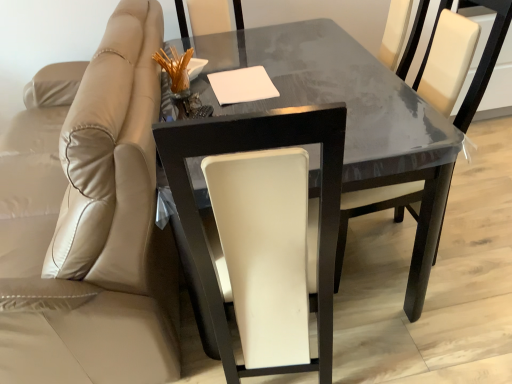
What do you see at coordinates (449, 61) in the screenshot? I see `white leather chair at center, positioned as the first chair in right-to-left order` at bounding box center [449, 61].

The image size is (512, 384). Identify the location of white leather chair at center, the third chair when ordered from left to right. (449, 61).

Find the location of a particular element. This screenshot has height=384, width=512. glossy dark wood table at center is located at coordinates (348, 114).

Image resolution: width=512 pixels, height=384 pixels. What do you see at coordinates (90, 225) in the screenshot? I see `beige leather chair at left, which appears as the third chair when viewed from the right` at bounding box center [90, 225].

Find the location of a particular element. The height and width of the screenshot is (384, 512). white leather chair at center, positioned as the first chair in right-to-left order is located at coordinates (449, 61).

Is beige leather chair at left, which is counted as the 1th chair, starting from the left, looking in the opposite direction of white leather chair at center, the third chair when ordered from left to right?

Absolutely, beige leather chair at left, which is counted as the 1th chair, starting from the left, is directed away from white leather chair at center, the third chair when ordered from left to right.

From a real-world perspective, is beige leather chair at left, which appears as the third chair when viewed from the right, above or below white leather chair at center, the third chair when ordered from left to right?

Clearly, from a real-world perspective, beige leather chair at left, which appears as the third chair when viewed from the right, is below white leather chair at center, the third chair when ordered from left to right.

Choose the correct answer: Is beige leather chair at left, which appears as the third chair when viewed from the right, inside white leather chair at center, positioned as the first chair in right-to-left order, or outside it?

beige leather chair at left, which appears as the third chair when viewed from the right, is outside white leather chair at center, positioned as the first chair in right-to-left order.

Considering the positions of point (61, 252) and point (419, 201), is point (61, 252) closer or farther from the camera than point (419, 201)?

Point (61, 252) is closer to the camera than point (419, 201).

Is white leather chair at center, which ranks as the second chair in right-to-left order, not near beige leather chair at left, which appears as the third chair when viewed from the right?

Indeed, white leather chair at center, which ranks as the second chair in right-to-left order, is not near beige leather chair at left, which appears as the third chair when viewed from the right.

From the image's perspective, between white leather chair at center, which ranks as the second chair in right-to-left order, and beige leather chair at left, which is counted as the 1th chair, starting from the left, who is located below?

beige leather chair at left, which is counted as the 1th chair, starting from the left, appears lower in the image.

Considering the sizes of white leather chair at center, placed as the 2th chair when sorted from left to right, and beige leather chair at left, which appears as the third chair when viewed from the right, in the image, is white leather chair at center, placed as the 2th chair when sorted from left to right, wider or thinner than beige leather chair at left, which appears as the third chair when viewed from the right,?

Considering their sizes, white leather chair at center, placed as the 2th chair when sorted from left to right, looks slimmer than beige leather chair at left, which appears as the third chair when viewed from the right.

Between glossy dark wood table at center and beige leather chair at left, which is counted as the 1th chair, starting from the left, which one appears on the left side from the viewer's perspective?

beige leather chair at left, which is counted as the 1th chair, starting from the left, is more to the left.

Between point (191, 290) and point (37, 320), which one is positioned in front?

The point (37, 320) is closer.

Would you say glossy dark wood table at center is inside or outside beige leather chair at left, which appears as the third chair when viewed from the right?

glossy dark wood table at center is not inside beige leather chair at left, which appears as the third chair when viewed from the right, it's outside.

Is white leather chair at center, the third chair when ordered from left to right, positioned with its back to glossy dark wood table at center?

Correct, white leather chair at center, the third chair when ordered from left to right, is looking away from glossy dark wood table at center.

Is point (435, 39) in front of point (389, 181)?

No.

Could you measure the distance between white leather chair at center, positioned as the first chair in right-to-left order, and glossy dark wood table at center?

45.23 centimeters.

Does white leather chair at center, positioned as the first chair in right-to-left order, have a greater height compared to glossy dark wood table at center?

Correct, white leather chair at center, positioned as the first chair in right-to-left order, is much taller as glossy dark wood table at center.

Can you confirm if beige leather chair at left, which appears as the third chair when viewed from the right, is positioned to the left of glossy dark wood table at center?

Yes.

Is beige leather chair at left, which appears as the third chair when viewed from the right, positioned far away from glossy dark wood table at center?

beige leather chair at left, which appears as the third chair when viewed from the right, is actually quite close to glossy dark wood table at center.

Locate an element on the screen. The height and width of the screenshot is (384, 512). table below the beige leather chair at left, which is counted as the 1th chair, starting from the left (from a real-world perspective) is located at coordinates (348, 114).

Based on the photo, which of these two, beige leather chair at left, which is counted as the 1th chair, starting from the left, or glossy dark wood table at center, is wider?

With larger width is beige leather chair at left, which is counted as the 1th chair, starting from the left.

Can you confirm if beige leather chair at left, which appears as the third chair when viewed from the right, is smaller than white leather chair at center, placed as the 2th chair when sorted from left to right?

No.

Considering the relative sizes of beige leather chair at left, which is counted as the 1th chair, starting from the left, and white leather chair at center, placed as the 2th chair when sorted from left to right, in the image provided, is beige leather chair at left, which is counted as the 1th chair, starting from the left, shorter than white leather chair at center, placed as the 2th chair when sorted from left to right,?

In fact, beige leather chair at left, which is counted as the 1th chair, starting from the left, may be taller than white leather chair at center, placed as the 2th chair when sorted from left to right.

Is beige leather chair at left, which is counted as the 1th chair, starting from the left, to the left or to the right of white leather chair at center, which ranks as the second chair in right-to-left order, in the image?

Clearly, beige leather chair at left, which is counted as the 1th chair, starting from the left, is on the left of white leather chair at center, which ranks as the second chair in right-to-left order, in the image.

Is beige leather chair at left, which is counted as the 1th chair, starting from the left, in front of or behind white leather chair at center, which ranks as the second chair in right-to-left order, in the image?

Visually, beige leather chair at left, which is counted as the 1th chair, starting from the left, is located in front of white leather chair at center, which ranks as the second chair in right-to-left order.

From the image's perspective, is glossy dark wood table at center under white leather chair at center, positioned as the first chair in right-to-left order?

Yes, from the image's perspective, glossy dark wood table at center is beneath white leather chair at center, positioned as the first chair in right-to-left order.

From a real-world perspective, is glossy dark wood table at center over white leather chair at center, the third chair when ordered from left to right?

No, from a real-world perspective, glossy dark wood table at center is not above white leather chair at center, the third chair when ordered from left to right.

Is glossy dark wood table at center at the right side of white leather chair at center, the third chair when ordered from left to right?

In fact, glossy dark wood table at center is to the left of white leather chair at center, the third chair when ordered from left to right.

Would you say glossy dark wood table at center is outside white leather chair at center, positioned as the first chair in right-to-left order?

Indeed, glossy dark wood table at center is completely outside white leather chair at center, positioned as the first chair in right-to-left order.

This screenshot has width=512, height=384. There is a white leather chair at center, the third chair when ordered from left to right. What are the coordinates of `the 1st chair above it (from the image's perspective)` in the screenshot? It's located at (90, 225).

From a real-world perspective, starting from the beige leather chair at left, which is counted as the 1th chair, starting from the left, which chair is the 2nd one vertically above it? Please provide its 2D coordinates.

[(207, 18)]

Looking at the image, which one is located closer to white leather chair at center, the third chair when ordered from left to right, beige leather chair at left, which appears as the third chair when viewed from the right, or white leather chair at center, which ranks as the second chair in right-to-left order?

white leather chair at center, which ranks as the second chair in right-to-left order.

From the picture: From the image, which object appears to be nearer to white leather chair at center, which ranks as the second chair in right-to-left order, white leather chair at center, positioned as the first chair in right-to-left order, or glossy dark wood table at center?

Among the two, glossy dark wood table at center is located nearer to white leather chair at center, which ranks as the second chair in right-to-left order.

Considering their positions, is beige leather chair at left, which appears as the third chair when viewed from the right, positioned closer to glossy dark wood table at center than white leather chair at center, which ranks as the second chair in right-to-left order?

Based on the image, beige leather chair at left, which appears as the third chair when viewed from the right, appears to be nearer to glossy dark wood table at center.

When comparing their distances from white leather chair at center, which ranks as the second chair in right-to-left order, does white leather chair at center, positioned as the first chair in right-to-left order, or beige leather chair at left, which is counted as the 1th chair, starting from the left, seem closer?

beige leather chair at left, which is counted as the 1th chair, starting from the left, is closer to white leather chair at center, which ranks as the second chair in right-to-left order.

Looking at the image, which one is located closer to glossy dark wood table at center, white leather chair at center, positioned as the first chair in right-to-left order, or beige leather chair at left, which appears as the third chair when viewed from the right?

white leather chair at center, positioned as the first chair in right-to-left order, is positioned closer to the anchor glossy dark wood table at center.

Looking at the image, which one is located further to beige leather chair at left, which is counted as the 1th chair, starting from the left, white leather chair at center, which ranks as the second chair in right-to-left order, or glossy dark wood table at center?

white leather chair at center, which ranks as the second chair in right-to-left order, is further to beige leather chair at left, which is counted as the 1th chair, starting from the left.

From the image, which object appears to be farther from white leather chair at center, positioned as the first chair in right-to-left order, beige leather chair at left, which is counted as the 1th chair, starting from the left, or glossy dark wood table at center?

beige leather chair at left, which is counted as the 1th chair, starting from the left.

Which object lies further to the anchor point glossy dark wood table at center, white leather chair at center, the third chair when ordered from left to right, or white leather chair at center, placed as the 2th chair when sorted from left to right?

The object further to glossy dark wood table at center is white leather chair at center, placed as the 2th chair when sorted from left to right.

The height and width of the screenshot is (384, 512). What are the coordinates of `chair between beige leather chair at left, which appears as the third chair when viewed from the right, and white leather chair at center, the third chair when ordered from left to right, in the horizontal direction` in the screenshot? It's located at (207, 18).

This screenshot has height=384, width=512. I want to click on table located between beige leather chair at left, which is counted as the 1th chair, starting from the left, and white leather chair at center, positioned as the first chair in right-to-left order, in the left-right direction, so click(348, 114).

Locate an element on the screen. This screenshot has height=384, width=512. table positioned between white leather chair at center, the third chair when ordered from left to right, and white leather chair at center, placed as the 2th chair when sorted from left to right, from near to far is located at coordinates coord(348,114).

Where is `table located between beige leather chair at left, which is counted as the 1th chair, starting from the left, and white leather chair at center, placed as the 2th chair when sorted from left to right, in the depth direction`? table located between beige leather chair at left, which is counted as the 1th chair, starting from the left, and white leather chair at center, placed as the 2th chair when sorted from left to right, in the depth direction is located at coordinates (348, 114).